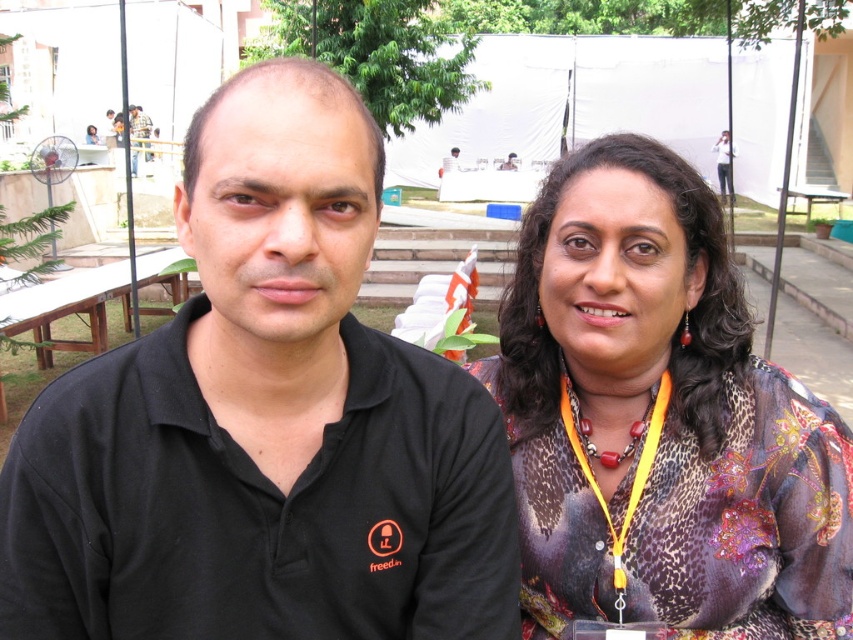
You are standing at the bottom of the steps leading to the white tent and want to walk to the point that is closer to the white tent. Which point should you aim for, point (248, 444) or point (643, 426)?

Point (248, 444) is in front of point (643, 426), so it is closer to the white tent. You should aim for point (248, 444).

You are a photographer trying to capture a photo of both the black matte shirt at left and the matte black shirt at center. Since you want both shirts to be clearly visible in the photo, which shirt should you focus on first to ensure proper focus, considering their sizes?

The black matte shirt at left has a greater height compared to the matte black shirt at center, so you should focus on the black matte shirt at left first to ensure it is in focus, then adjust for the matte black shirt at center.

You are planning to take a photo of the black matte shirt at left and ensure it is centered in the frame. Given the shirt is at coordinates point 0.661, 0.311, where should you position your camera to capture it properly?

The black matte shirt at left is located at point (x=264, y=422), so to center it in the frame, position the camera so that the center of the viewfinder aligns with those coordinates.